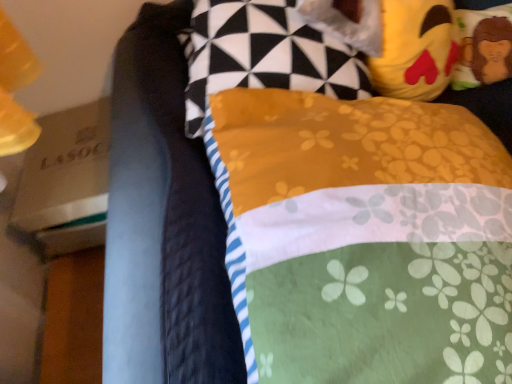
This screenshot has height=384, width=512. Describe the element at coordinates (395, 40) in the screenshot. I see `yellow plush toy at upper right` at that location.

I want to click on yellow plush toy at upper right, which appears as the 3th pillow when viewed from the left, so click(x=484, y=47).

Is yellow plush toy at upper right, which appears as the 3th pillow when viewed from the left, not within yellow fabric pillow at upper right, the 2th pillow when ordered from left to right?

Yes.

From the image's perspective, between yellow plush toy at upper right, which appears as the 3th pillow when viewed from the left, and yellow fabric pillow at upper right, which is counted as the 2th pillow, starting from the right, which one is located above?

From the image's view, yellow plush toy at upper right, which appears as the 3th pillow when viewed from the left, is above.

Image resolution: width=512 pixels, height=384 pixels. I want to click on the 2nd pillow behind the yellow fabric pillow at upper right, which is counted as the 2th pillow, starting from the right, so click(484, 47).

Considering the sizes of yellow fabric pillow at upper right, which is counted as the 2th pillow, starting from the right, and yellow plush toy at upper right in the image, is yellow fabric pillow at upper right, which is counted as the 2th pillow, starting from the right, taller or shorter than yellow plush toy at upper right?

In the image, yellow fabric pillow at upper right, which is counted as the 2th pillow, starting from the right, appears to be taller than yellow plush toy at upper right.

From the image's perspective, which one is positioned lower, yellow fabric pillow at upper right, which is counted as the 2th pillow, starting from the right, or yellow plush toy at upper right?

yellow fabric pillow at upper right, which is counted as the 2th pillow, starting from the right, from the image's perspective.

Do you think yellow fabric pillow at upper right, the 2th pillow when ordered from left to right, is within yellow plush toy at upper right, or outside of it?

The correct answer is: outside.

Is yellow fabric pillow at upper right, the 2th pillow when ordered from left to right, facing towards yellow plush toy at upper right?

No, yellow fabric pillow at upper right, the 2th pillow when ordered from left to right, is not facing towards yellow plush toy at upper right.

Would you say yellow plush toy at upper right is inside or outside yellow plush toy at upper right, which appears as the 3th pillow when viewed from the left?

yellow plush toy at upper right is outside yellow plush toy at upper right, which appears as the 3th pillow when viewed from the left.

This screenshot has height=384, width=512. I want to click on pillow behind the yellow plush toy at upper right, so click(x=484, y=47).

How different are the orientations of yellow plush toy at upper right and yellow plush toy at upper right, the 1th pillow when ordered from right to left, in degrees?

9.07 degrees separate the facing orientations of yellow plush toy at upper right and yellow plush toy at upper right, the 1th pillow when ordered from right to left.

From a real-world perspective, is yellow plush toy at upper right positioned under yellow plush toy at upper right, which appears as the 3th pillow when viewed from the left, based on gravity?

Incorrect, from a real-world perspective, yellow plush toy at upper right is higher than yellow plush toy at upper right, which appears as the 3th pillow when viewed from the left.

Locate an element on the screen. This screenshot has height=384, width=512. pillow below the yellow fabric pillow at upper center, the 1th pillow when ordered from left to right (from the image's perspective) is located at coordinates (368, 237).

How distant is yellow fabric pillow at upper right, which is counted as the 2th pillow, starting from the right, from yellow fabric pillow at upper center, which appears as the 3th pillow when viewed from the right?

yellow fabric pillow at upper right, which is counted as the 2th pillow, starting from the right, and yellow fabric pillow at upper center, which appears as the 3th pillow when viewed from the right, are 22.49 centimeters apart from each other.

Does yellow fabric pillow at upper right, which is counted as the 2th pillow, starting from the right, turn towards yellow fabric pillow at upper center, which appears as the 3th pillow when viewed from the right?

No.

Which of these two, yellow fabric pillow at upper right, the 2th pillow when ordered from left to right, or yellow fabric pillow at upper center, the 1th pillow when ordered from left to right, stands shorter?

yellow fabric pillow at upper center, the 1th pillow when ordered from left to right.

Identify the location of pillow that is the 1st one when counting forward from the yellow plush toy at upper right, the 1th pillow when ordered from right to left. The width and height of the screenshot is (512, 384). pyautogui.click(x=274, y=51).

Is yellow fabric pillow at upper center, which appears as the 3th pillow when viewed from the right, located outside yellow plush toy at upper right, the 1th pillow when ordered from right to left?

yellow fabric pillow at upper center, which appears as the 3th pillow when viewed from the right, lies outside yellow plush toy at upper right, the 1th pillow when ordered from right to left,'s area.

Considering the relative positions of yellow fabric pillow at upper center, the 1th pillow when ordered from left to right, and yellow plush toy at upper right, which appears as the 3th pillow when viewed from the left, in the image provided, is yellow fabric pillow at upper center, the 1th pillow when ordered from left to right, to the left of yellow plush toy at upper right, which appears as the 3th pillow when viewed from the left, from the viewer's perspective?

Yes, yellow fabric pillow at upper center, the 1th pillow when ordered from left to right, is to the left of yellow plush toy at upper right, which appears as the 3th pillow when viewed from the left.

Is yellow fabric pillow at upper center, which appears as the 3th pillow when viewed from the right, aimed at yellow plush toy at upper right, the 1th pillow when ordered from right to left?

Yes, yellow fabric pillow at upper center, which appears as the 3th pillow when viewed from the right, is turned towards yellow plush toy at upper right, the 1th pillow when ordered from right to left.

From the image's perspective, is yellow fabric pillow at upper right, which is counted as the 2th pillow, starting from the right, located above or below yellow plush toy at upper right, which appears as the 3th pillow when viewed from the left?

yellow fabric pillow at upper right, which is counted as the 2th pillow, starting from the right, is below yellow plush toy at upper right, which appears as the 3th pillow when viewed from the left.

From a real-world perspective, is yellow fabric pillow at upper right, which is counted as the 2th pillow, starting from the right, above or below yellow plush toy at upper right, which appears as the 3th pillow when viewed from the left?

In terms of real-world spatial position, yellow fabric pillow at upper right, which is counted as the 2th pillow, starting from the right, is above yellow plush toy at upper right, which appears as the 3th pillow when viewed from the left.

Can you confirm if yellow fabric pillow at upper right, the 2th pillow when ordered from left to right, is shorter than yellow plush toy at upper right, the 1th pillow when ordered from right to left?

In fact, yellow fabric pillow at upper right, the 2th pillow when ordered from left to right, may be taller than yellow plush toy at upper right, the 1th pillow when ordered from right to left.

Does yellow fabric pillow at upper right, the 2th pillow when ordered from left to right, appear on the left side of yellow plush toy at upper right, the 1th pillow when ordered from right to left?

Indeed, yellow fabric pillow at upper right, the 2th pillow when ordered from left to right, is positioned on the left side of yellow plush toy at upper right, the 1th pillow when ordered from right to left.

Between yellow fabric pillow at upper center, which appears as the 3th pillow when viewed from the right, and yellow plush toy at upper right, which one appears on the right side from the viewer's perspective?

yellow plush toy at upper right.

Is yellow fabric pillow at upper center, which appears as the 3th pillow when viewed from the right, far from yellow plush toy at upper right?

No, there isn't a large distance between yellow fabric pillow at upper center, which appears as the 3th pillow when viewed from the right, and yellow plush toy at upper right.

Is yellow plush toy at upper right at the back of yellow fabric pillow at upper center, the 1th pillow when ordered from left to right?

No, yellow fabric pillow at upper center, the 1th pillow when ordered from left to right, is not facing the opposite direction of yellow plush toy at upper right.

From the image's perspective, does yellow fabric pillow at upper center, the 1th pillow when ordered from left to right, appear lower than yellow plush toy at upper right?

Yes, from the image's perspective, yellow fabric pillow at upper center, the 1th pillow when ordered from left to right, is beneath yellow plush toy at upper right.

Identify the location of the 2nd pillow below the yellow plush toy at upper right, which appears as the 3th pillow when viewed from the left (from the image's perspective). The width and height of the screenshot is (512, 384). (368, 237).

Locate an element on the screen. Image resolution: width=512 pixels, height=384 pixels. figurine directly beneath the yellow fabric pillow at upper right, the 2th pillow when ordered from left to right (from a real-world perspective) is located at coordinates point(395,40).

When comparing their distances from yellow fabric pillow at upper right, which is counted as the 2th pillow, starting from the right, does yellow plush toy at upper right or yellow fabric pillow at upper center, the 1th pillow when ordered from left to right, seem closer?

yellow fabric pillow at upper center, the 1th pillow when ordered from left to right, lies closer to yellow fabric pillow at upper right, which is counted as the 2th pillow, starting from the right, than the other object.

Which object lies nearer to the anchor point yellow plush toy at upper right, the 1th pillow when ordered from right to left, yellow plush toy at upper right or yellow fabric pillow at upper right, which is counted as the 2th pillow, starting from the right?

yellow plush toy at upper right.

When comparing their distances from yellow plush toy at upper right, which appears as the 3th pillow when viewed from the left, does yellow fabric pillow at upper center, which appears as the 3th pillow when viewed from the right, or yellow fabric pillow at upper right, the 2th pillow when ordered from left to right, seem closer?

yellow fabric pillow at upper center, which appears as the 3th pillow when viewed from the right, lies closer to yellow plush toy at upper right, which appears as the 3th pillow when viewed from the left, than the other object.

Based on their spatial positions, is yellow fabric pillow at upper right, the 2th pillow when ordered from left to right, or yellow fabric pillow at upper center, which appears as the 3th pillow when viewed from the right, closer to yellow plush toy at upper right?

Among the two, yellow fabric pillow at upper center, which appears as the 3th pillow when viewed from the right, is located nearer to yellow plush toy at upper right.

Based on their spatial positions, is yellow plush toy at upper right or yellow fabric pillow at upper center, the 1th pillow when ordered from left to right, closer to yellow plush toy at upper right, which appears as the 3th pillow when viewed from the left?

yellow plush toy at upper right is closer to yellow plush toy at upper right, which appears as the 3th pillow when viewed from the left.

Estimate the real-world distances between objects in this image. Which object is further from yellow plush toy at upper right, yellow fabric pillow at upper center, which appears as the 3th pillow when viewed from the right, or yellow plush toy at upper right, which appears as the 3th pillow when viewed from the left?

yellow plush toy at upper right, which appears as the 3th pillow when viewed from the left, lies further to yellow plush toy at upper right than the other object.

When comparing their distances from yellow fabric pillow at upper right, the 2th pillow when ordered from left to right, does yellow plush toy at upper right or yellow plush toy at upper right, which appears as the 3th pillow when viewed from the left, seem closer?

yellow plush toy at upper right lies closer to yellow fabric pillow at upper right, the 2th pillow when ordered from left to right, than the other object.

Which object lies further to the anchor point yellow fabric pillow at upper right, the 2th pillow when ordered from left to right, yellow fabric pillow at upper center, which appears as the 3th pillow when viewed from the right, or yellow plush toy at upper right?

yellow plush toy at upper right is further to yellow fabric pillow at upper right, the 2th pillow when ordered from left to right.

This screenshot has height=384, width=512. In order to click on figurine located between yellow fabric pillow at upper center, the 1th pillow when ordered from left to right, and yellow plush toy at upper right, the 1th pillow when ordered from right to left, in the left-right direction in this screenshot , I will do `click(395, 40)`.

The height and width of the screenshot is (384, 512). In order to click on pillow between yellow fabric pillow at upper right, the 2th pillow when ordered from left to right, and yellow plush toy at upper right, along the z-axis in this screenshot , I will do `click(274, 51)`.

At what (x,y) coordinates should I click in order to perform the action: click on pillow located between yellow fabric pillow at upper right, which is counted as the 2th pillow, starting from the right, and yellow plush toy at upper right, the 1th pillow when ordered from right to left, in the depth direction. Please return your answer as a coordinate pair (x, y). The image size is (512, 384). Looking at the image, I should click on [274, 51].

This screenshot has height=384, width=512. I want to click on figurine between yellow fabric pillow at upper right, the 2th pillow when ordered from left to right, and yellow plush toy at upper right, the 1th pillow when ordered from right to left, in the front-back direction, so click(x=395, y=40).